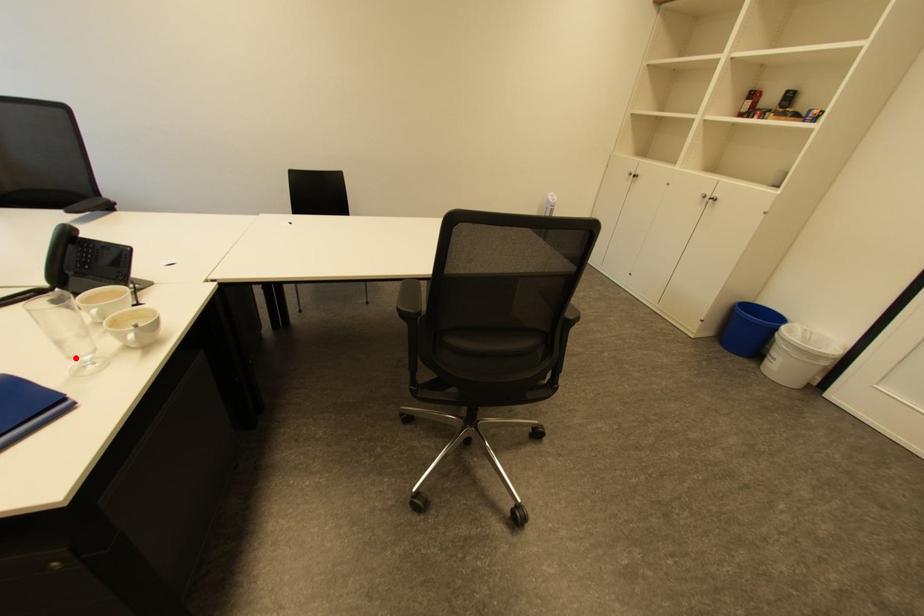
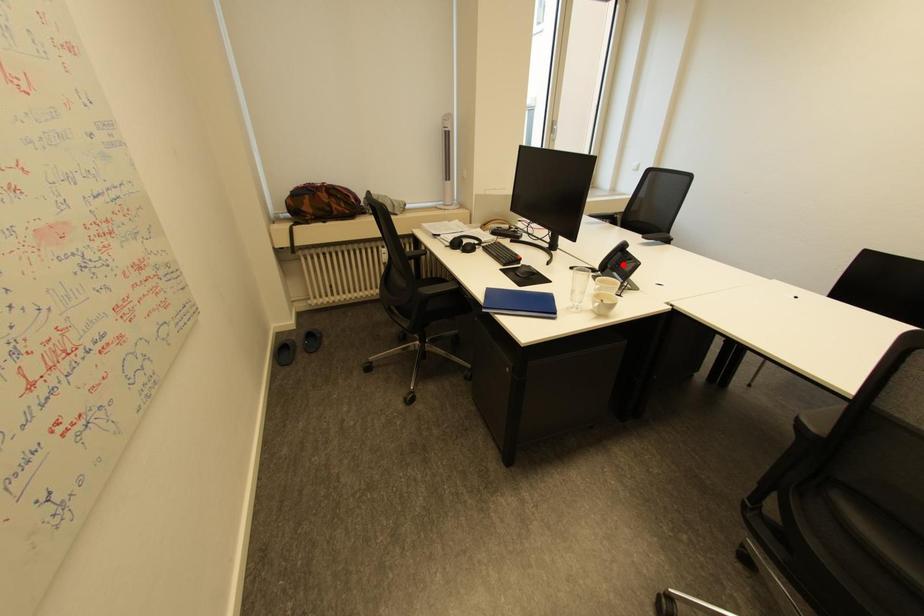
I am providing you with two images of the same scene from different viewpoints. A red point is marked on the first image and another point is marked on the second image. Is the red point in image1 aligned with the point shown in image2?

No